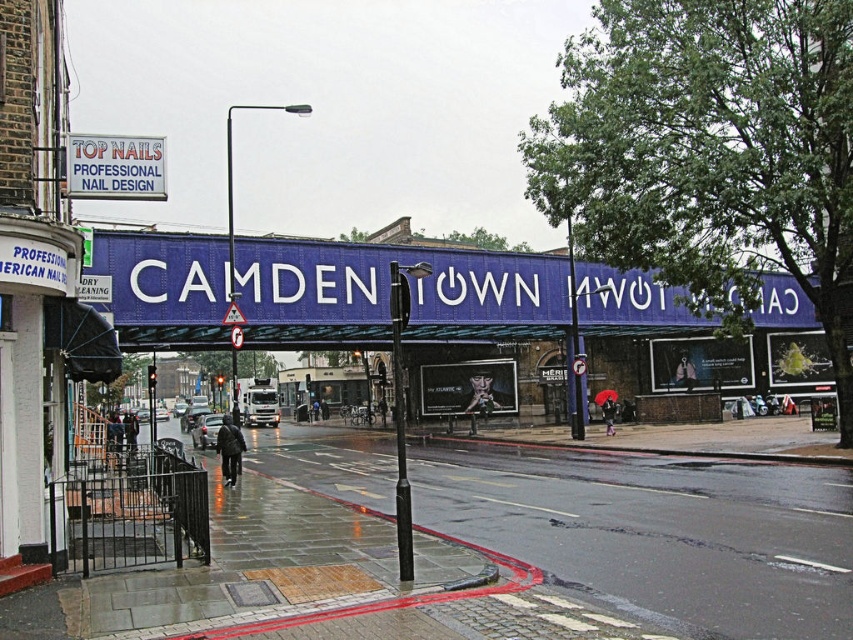
You are standing in Camden Town and want to take a photo that includes both the Camden Town sign and the Top Nails store. You notice two points marked on the ground at coordinates point (606, 493) and point (86, 177). Which point should you stand closer to in order to ensure both landmarks are in the frame?

You should stand closer to point (86, 177) because point (606, 493) is further away from you, so positioning yourself near the closer point will help include both landmarks in the photo frame.

You are a pedestrian walking along the street in Camden Town and see the dark gray jacket at center and the matte black umbrella at center. Which object is closer to the left side of the street?

The dark gray jacket at center is closer to the left side of the street because it is positioned to the left of the matte black umbrella at center.

You are a delivery person trying to avoid puddles on the concrete sidewalk at lower left. You see the white plastic sign at upper left. Which object is bigger in size?

The concrete sidewalk at lower left has a larger size compared to the white plastic sign at upper left, so the concrete sidewalk at lower left is bigger.